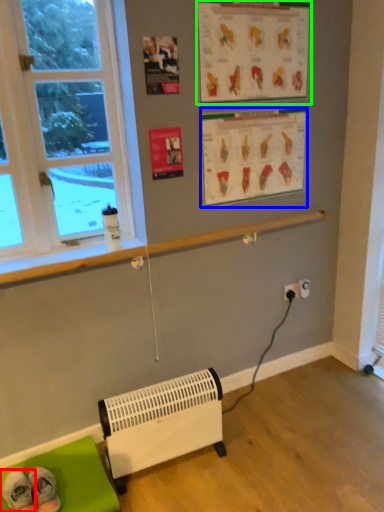
Question: Based on their relative distances, which object is nearer to footwear (highlighted by a red box)? Choose from writing (highlighted by a blue box) and writing (highlighted by a green box).

Choices:
 (A) writing
 (B) writing

Answer: (A)